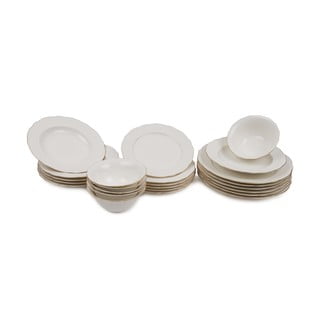
The image size is (320, 320). I want to click on dishes in second stack from the left, so click(x=131, y=182), click(x=136, y=185), click(x=131, y=190), click(x=128, y=195), click(x=125, y=203).